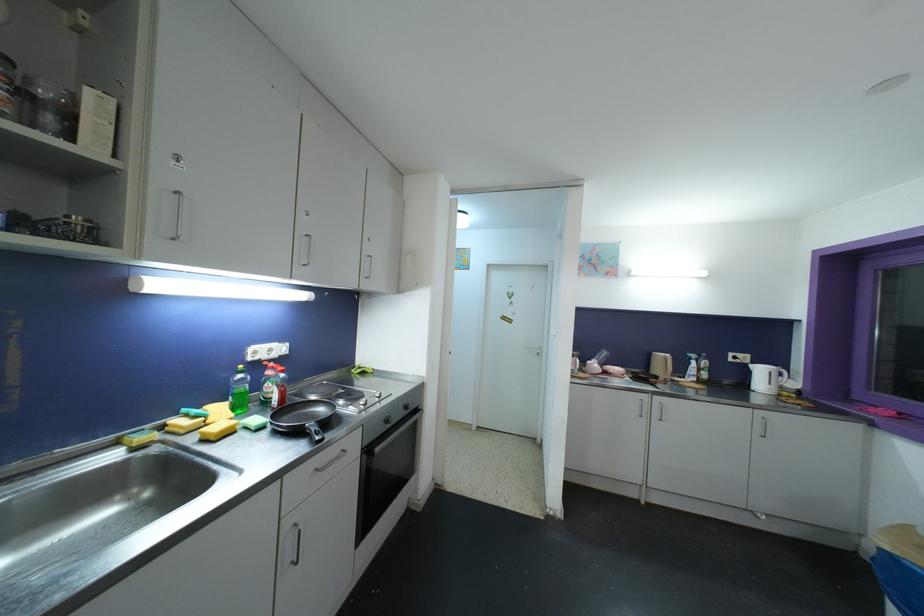
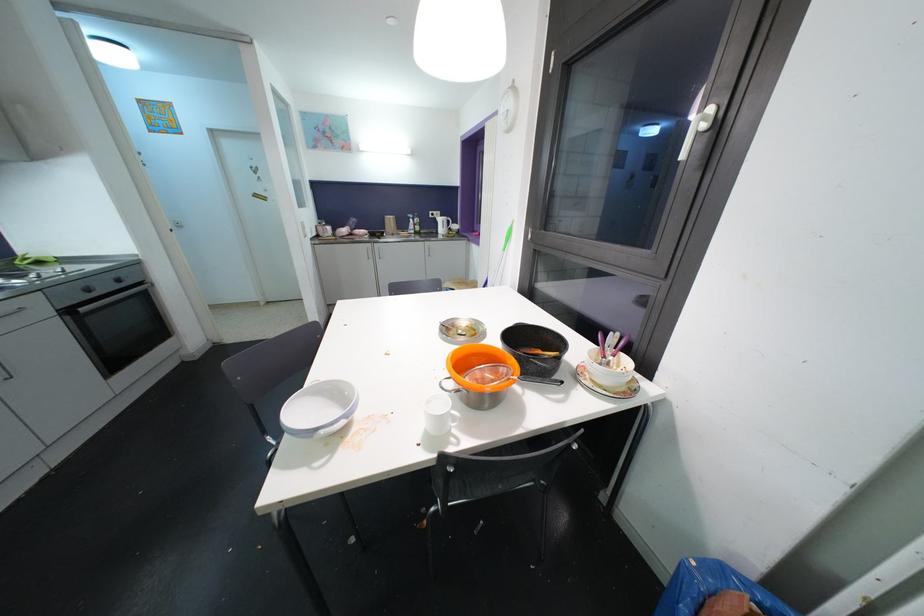
Find the pixel in the second image that matches [763,373] in the first image.

(444, 223)